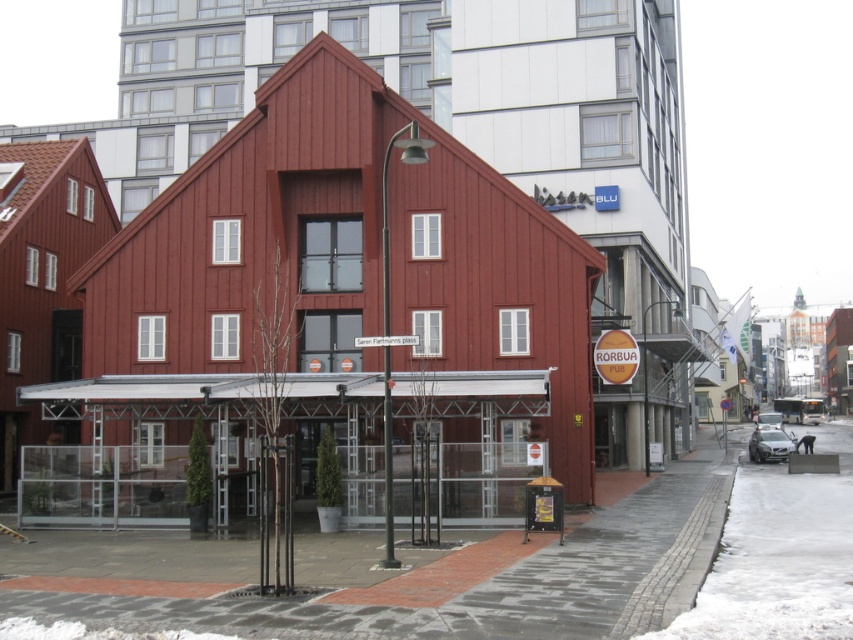
Is brick pavement at center taller than white powdery snow at lower right?

Incorrect, brick pavement at center's height is not larger of white powdery snow at lower right's.

Is brick pavement at center closer to camera compared to white powdery snow at lower right?

Yes, it is.

Between point (260, 634) and point (805, 573), which one is positioned behind?

Positioned behind is point (805, 573).

The width and height of the screenshot is (853, 640). Find the location of `brick pavement at center`. brick pavement at center is located at coordinates (392, 573).